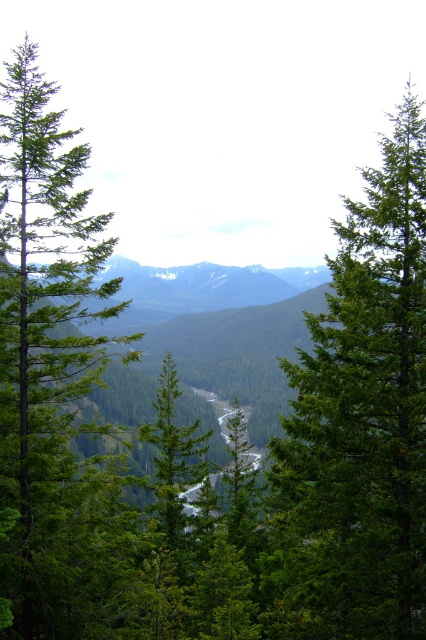
Is green matte tree at center above green matte tree at left?

No.

This screenshot has width=426, height=640. Describe the element at coordinates (359, 420) in the screenshot. I see `green matte tree at center` at that location.

Locate an element on the screen. The height and width of the screenshot is (640, 426). green matte tree at center is located at coordinates (359, 420).